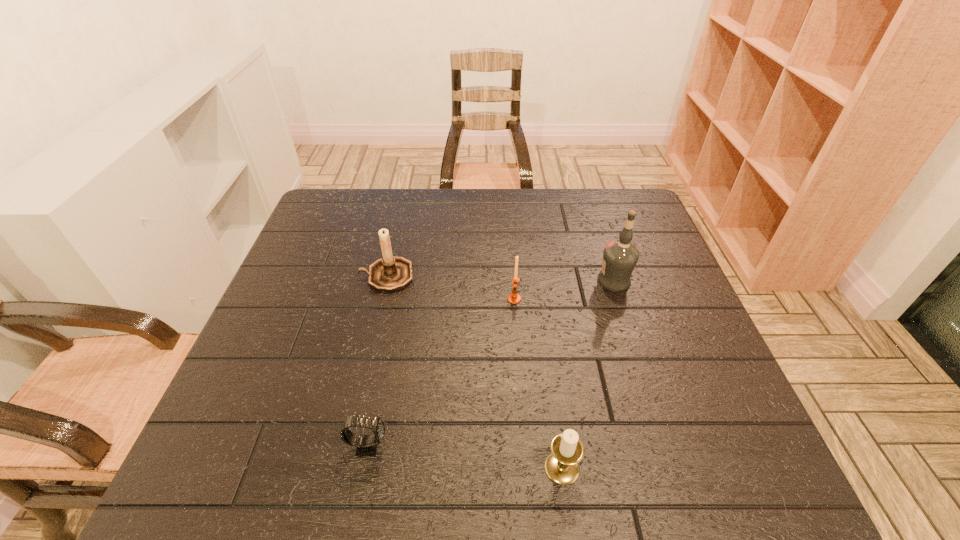
Find the location of `vacant point at the right edge`. vacant point at the right edge is located at coordinates (642, 266).

The width and height of the screenshot is (960, 540). In order to click on vacant area at the far left corner in this screenshot , I will do `click(367, 203)`.

Find the location of a particular element. This screenshot has width=960, height=540. vacant point at the near left corner is located at coordinates (269, 493).

Locate an element on the screen. The height and width of the screenshot is (540, 960). vacant space at the near right corner of the desktop is located at coordinates (726, 478).

Image resolution: width=960 pixels, height=540 pixels. Find the location of `vacant point located between the rightmost object and the watch`. vacant point located between the rightmost object and the watch is located at coordinates (491, 363).

You are a GUI agent. You are given a task and a screenshot of the screen. Output one action in this format:
    pyautogui.click(x=<x>, y=<y>)
    Task: Click on the vacant point located between the third object from right to left and the watch
    This screenshot has width=960, height=540.
    Given the screenshot: What is the action you would take?
    pyautogui.click(x=441, y=373)

The image size is (960, 540). I want to click on unoccupied position between the third farthest object and the shortest object, so click(441, 373).

This screenshot has width=960, height=540. Identify the location of free spot between the watch and the second candle holder from left to right. (441, 373).

This screenshot has width=960, height=540. Identify the location of empty location between the second candle holder from left to right and the nearest candle holder. (538, 383).

The width and height of the screenshot is (960, 540). What are the coordinates of `vacant area between the tallest object and the shortest object` in the screenshot? It's located at (491, 363).